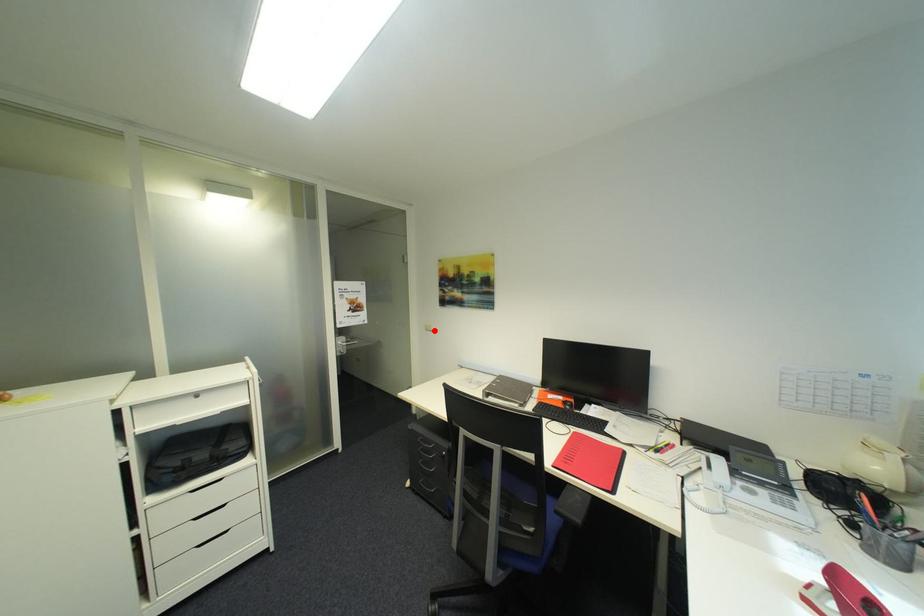
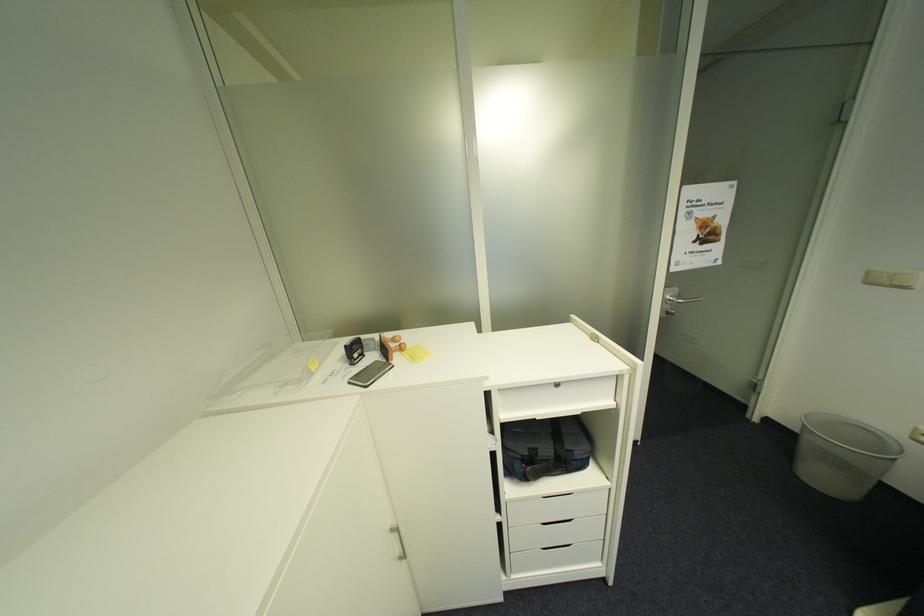
The point at the highlighted location is marked in the first image. Where is the corresponding point in the second image?

(876, 284)